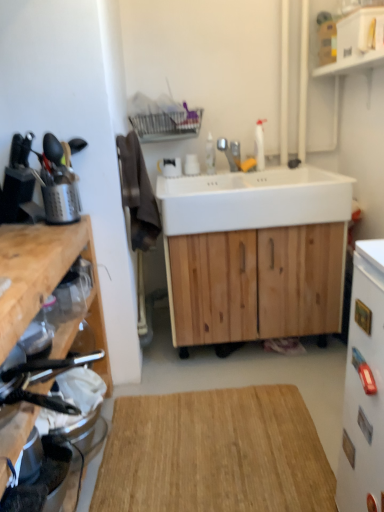
At what (x,y) coordinates should I click in order to perform the action: click on vacant area on top of wooden cutting board at left, the second cabinetry viewed from the back (from a real-world perspective). Please return your answer as a coordinate pair (x, y). The height and width of the screenshot is (512, 384). Looking at the image, I should click on (29, 242).